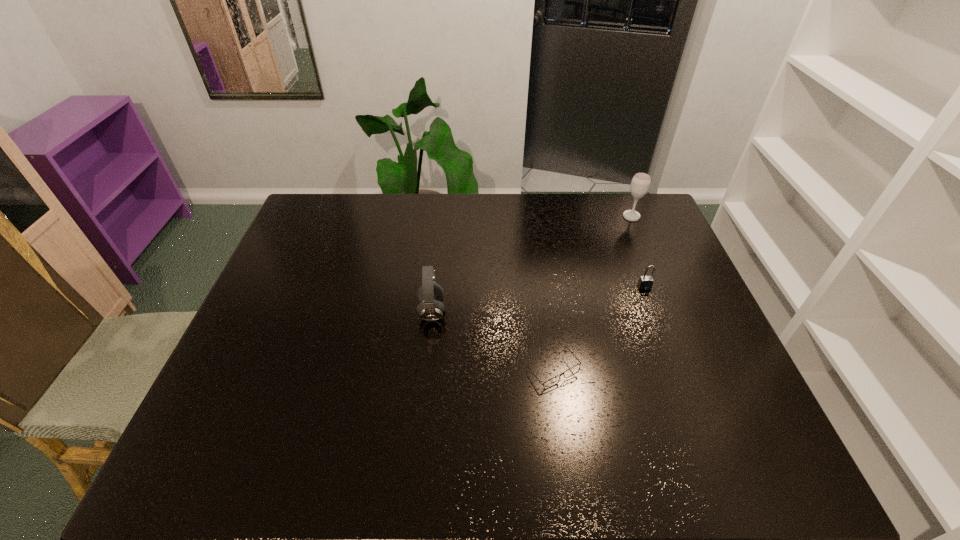
You are a GUI agent. You are given a task and a screenshot of the screen. Output one action in this format:
    pyautogui.click(x=<x>, y=<y>)
    Task: Click on the free space between the nearest object and the third tallest object
    
    Given the screenshot: What is the action you would take?
    pyautogui.click(x=599, y=329)

You are a GUI agent. You are given a task and a screenshot of the screen. Output one action in this format:
    pyautogui.click(x=<x>, y=<y>)
    Task: Click on the free spot between the shortest object and the third farthest object
    Image resolution: width=960 pixels, height=540 pixels.
    Given the screenshot: What is the action you would take?
    pyautogui.click(x=492, y=341)

I want to click on free space between the third object from right to left and the farthest object, so click(x=592, y=294).

Find the location of `free space between the third nearest object and the second object from left to right`. free space between the third nearest object and the second object from left to right is located at coordinates (599, 329).

Identify the location of free point between the farthest object and the third nearest object. This screenshot has height=540, width=960. pyautogui.click(x=637, y=252).

The image size is (960, 540). Identify the location of free space between the nearest object and the wineglass. (592, 294).

You are a GUI agent. You are given a task and a screenshot of the screen. Output one action in this format:
    pyautogui.click(x=<x>, y=<y>)
    Task: Click on the empty space that is in between the headset and the second object from left to right
    The image size is (960, 540).
    Given the screenshot: What is the action you would take?
    click(x=492, y=341)

You are a GUI agent. You are given a task and a screenshot of the screen. Output one action in this format:
    pyautogui.click(x=<x>, y=<y>)
    Task: Click on the vacant space in between the second farthest object and the wineglass
    Image resolution: width=960 pixels, height=540 pixels.
    Given the screenshot: What is the action you would take?
    (x=637, y=252)

The image size is (960, 540). Find the location of `empty space that is in between the leftmost object and the shortest object`. empty space that is in between the leftmost object and the shortest object is located at coordinates (492, 341).

At what (x,y) coordinates should I click in order to perform the action: click on vacant area that lies between the headset and the third nearest object. Please return your answer as a coordinate pair (x, y). Looking at the image, I should click on pyautogui.click(x=539, y=299).